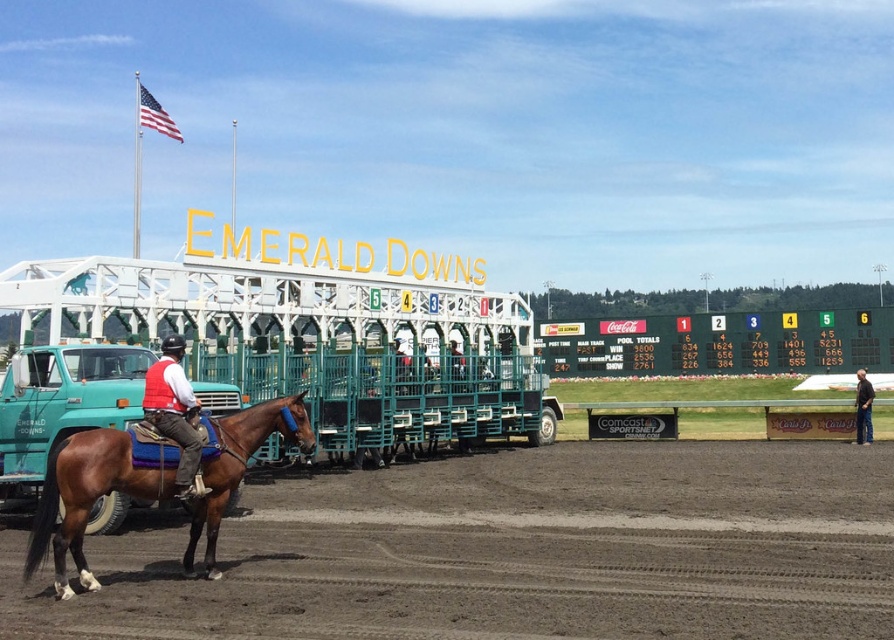
Question: Is green plastic scoreboard at center wider than matte red vest at center?

Choices:
 (A) yes
 (B) no

Answer: (A)

Question: Among these points, which one is nearest to the camera?

Choices:
 (A) (238, 412)
 (B) (255, 524)
 (C) (867, 380)

Answer: (B)

Question: Considering the relative positions of brown glossy horse at center and matte red vest at center in the image provided, where is brown glossy horse at center located with respect to matte red vest at center?

Choices:
 (A) left
 (B) right

Answer: (A)

Question: Is brown glossy horse at center positioned before matte red vest at center?

Choices:
 (A) yes
 (B) no

Answer: (A)

Question: Which of the following is the farthest from the observer?

Choices:
 (A) dirt at lower center
 (B) matte red vest at center

Answer: (B)

Question: Which object is the farthest from the brown glossy horse at center?

Choices:
 (A) dirt at lower center
 (B) teal matte truck at left

Answer: (A)